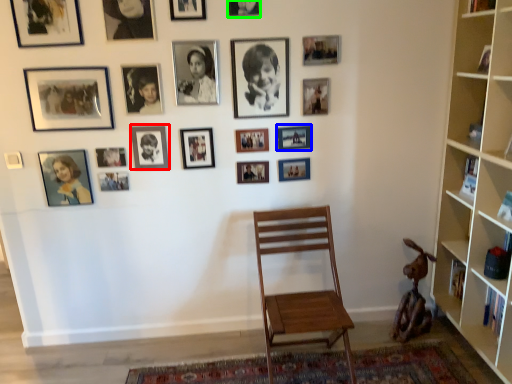
Question: Based on their relative distances, which object is nearer to picture frame (highlighted by a red box)? Choose from picture frame (highlighted by a blue box) and picture frame (highlighted by a green box).

Choices:
 (A) picture frame
 (B) picture frame

Answer: (A)